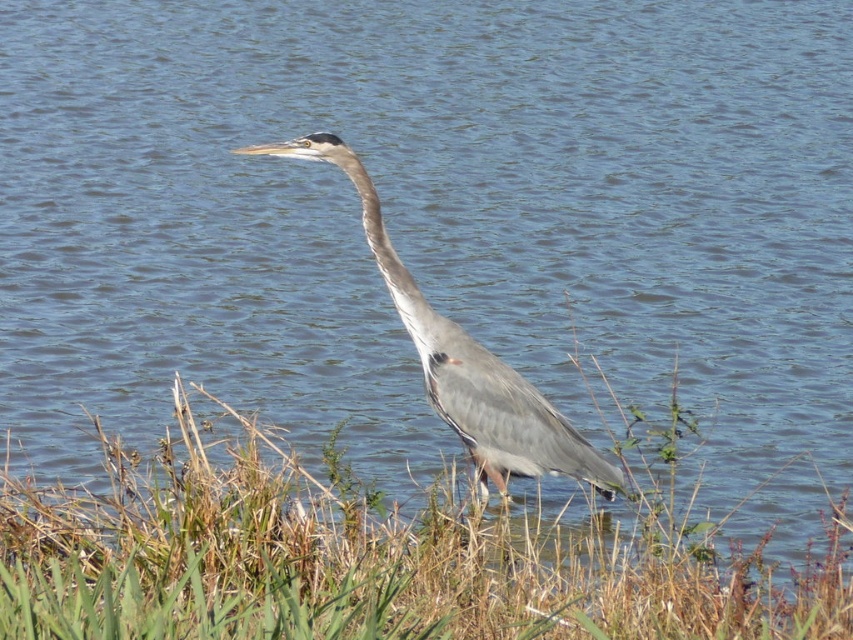
Question: Which of the following is the farthest from the observer?

Choices:
 (A) green grass at lower center
 (B) gray matte heron at center

Answer: (B)

Question: Is gray matte heron at center smaller than gray matte neck at center?

Choices:
 (A) yes
 (B) no

Answer: (B)

Question: Can you confirm if green grass at lower center is positioned above gray matte heron at center?

Choices:
 (A) yes
 (B) no

Answer: (B)

Question: Which object is farther from the camera taking this photo?

Choices:
 (A) gray matte heron at center
 (B) green grass at lower center
 (C) gray matte neck at center

Answer: (C)

Question: Which point appears farthest from the camera in this image?

Choices:
 (A) (360, 173)
 (B) (392, 272)
 (C) (834, 515)

Answer: (B)

Question: Is the position of gray matte heron at center less distant than that of gray matte neck at center?

Choices:
 (A) yes
 (B) no

Answer: (A)